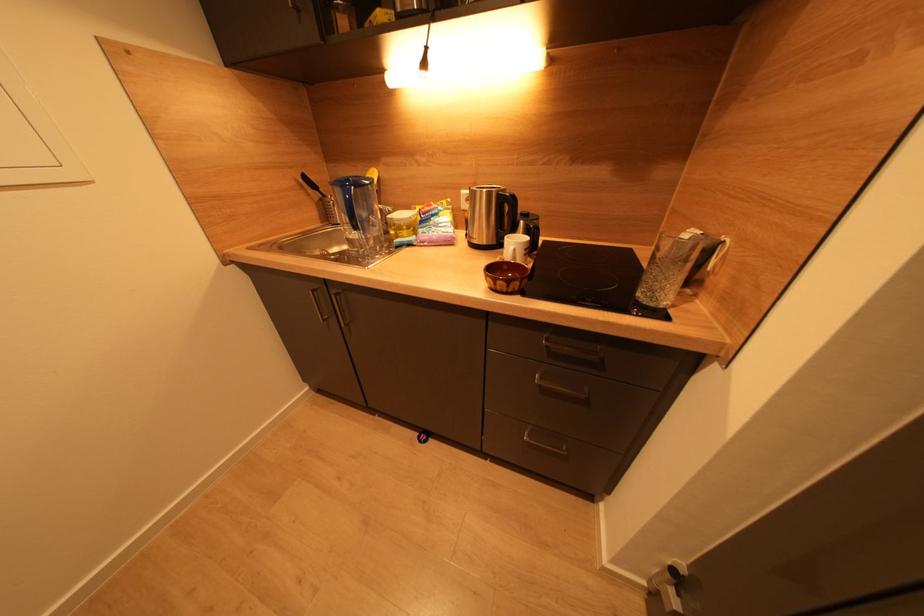
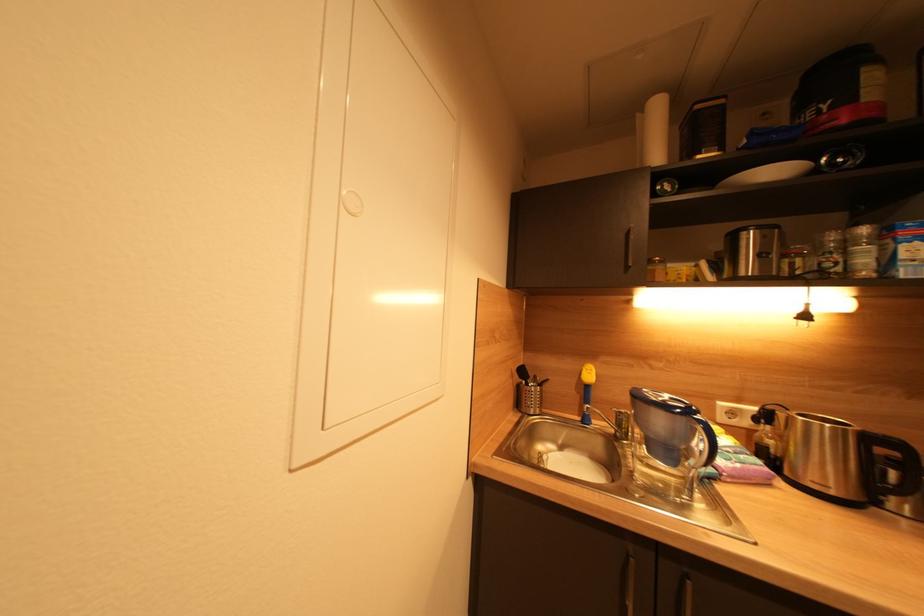
Question: The first image is from the beginning of the video and the second image is from the end. How did the camera likely rotate when shooting the video?

Choices:
 (A) Left
 (B) Right
 (C) Up
 (D) Down

Answer: (C)